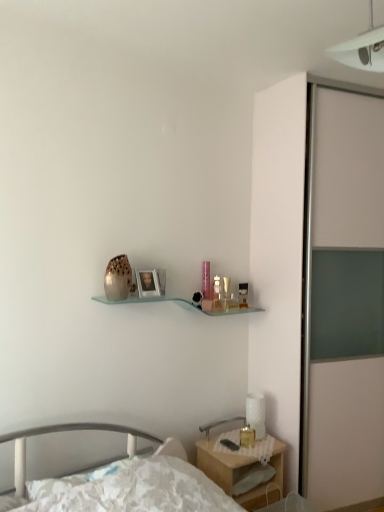
Question: From the image's perspective, is matte silver picture frame at center above translucent glass candle at bedside?

Choices:
 (A) no
 (B) yes

Answer: (B)

Question: Is matte silver picture frame at center not inside translucent glass candle at bedside?

Choices:
 (A) yes
 (B) no

Answer: (A)

Question: From a real-world perspective, does matte silver picture frame at center sit lower than translucent glass candle at bedside?

Choices:
 (A) no
 (B) yes

Answer: (A)

Question: Is matte silver picture frame at center positioned far away from translucent glass candle at bedside?

Choices:
 (A) yes
 (B) no

Answer: (B)

Question: Is translucent glass candle at bedside at the back of matte silver picture frame at center?

Choices:
 (A) no
 (B) yes

Answer: (A)

Question: Is translucent glass perfume bottle at upper center, which appears as the second toiletry when viewed from the right, in front of or behind white textured table lamp at lower right in the image?

Choices:
 (A) front
 (B) behind

Answer: (B)

Question: Would you say translucent glass perfume bottle at upper center, the first toiletry positioned from the front, is inside or outside white textured table lamp at lower right?

Choices:
 (A) inside
 (B) outside

Answer: (B)

Question: Considering the relative positions of translucent glass perfume bottle at upper center, the first toiletry from the left, and white textured table lamp at lower right in the image provided, is translucent glass perfume bottle at upper center, the first toiletry from the left, to the left or to the right of white textured table lamp at lower right?

Choices:
 (A) right
 (B) left

Answer: (B)

Question: Considering the positions of translucent glass perfume bottle at upper center, the first toiletry positioned from the front, and white textured table lamp at lower right in the image, is translucent glass perfume bottle at upper center, the first toiletry positioned from the front, bigger or smaller than white textured table lamp at lower right?

Choices:
 (A) small
 (B) big

Answer: (A)

Question: Based on their sizes in the image, would you say translucent glass candle at bedside is bigger or smaller than white floral fabric bed at lower left?

Choices:
 (A) small
 (B) big

Answer: (A)

Question: Considering the positions of translucent glass candle at bedside and white floral fabric bed at lower left in the image, is translucent glass candle at bedside wider or thinner than white floral fabric bed at lower left?

Choices:
 (A) thin
 (B) wide

Answer: (A)

Question: From a real-world perspective, is translucent glass candle at bedside positioned above or below white floral fabric bed at lower left?

Choices:
 (A) below
 (B) above

Answer: (B)

Question: In terms of height, does translucent glass candle at bedside look taller or shorter compared to white floral fabric bed at lower left?

Choices:
 (A) short
 (B) tall

Answer: (A)

Question: Is white plastic light fixture at upper right to the left or to the right of translucent glass candle at bedside in the image?

Choices:
 (A) right
 (B) left

Answer: (A)

Question: Is point (337, 60) positioned closer to the camera than point (240, 441)?

Choices:
 (A) closer
 (B) farther

Answer: (A)